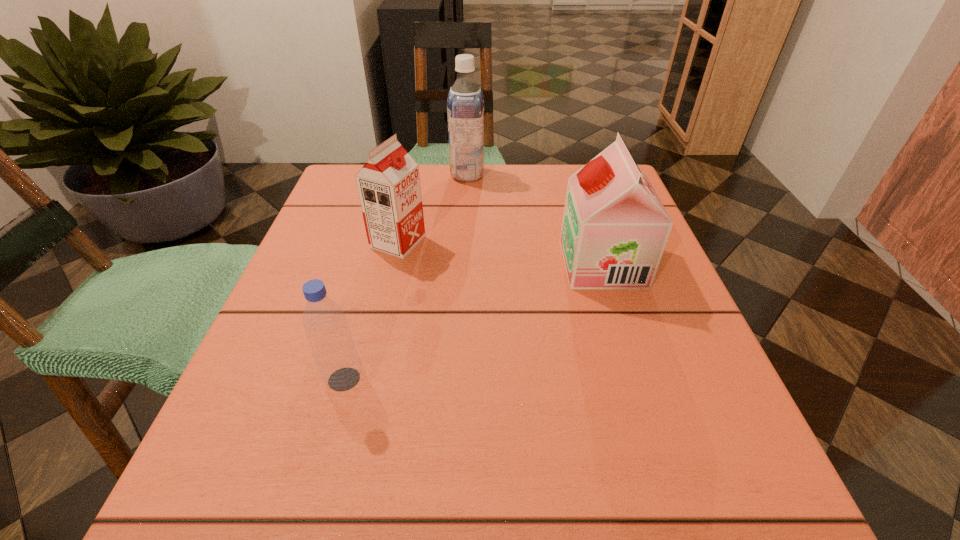
Find the location of a particular element. free spot between the farthest soya milk and the leftmost soya milk is located at coordinates (433, 208).

Identify which object is the third closest to the nearest object. Please provide its 2D coordinates. Your answer should be formatted as a tuple, i.e. [(x, y)], where the tuple contains the x and y coordinates of a point satisfying the conditions above.

[(465, 103)]

In order to click on the third closest object to the bottle in this screenshot , I will do [x=465, y=103].

You are a GUI agent. You are given a task and a screenshot of the screen. Output one action in this format:
    pyautogui.click(x=<x>, y=<y>)
    Task: Click on the soya milk that can be found as the second closest to the farthest soya milk
    The height and width of the screenshot is (540, 960).
    Given the screenshot: What is the action you would take?
    pyautogui.click(x=615, y=228)

At what (x,y) coordinates should I click in order to perform the action: click on soya milk that can be found as the closest to the tallest soya milk. Please return your answer as a coordinate pair (x, y). Looking at the image, I should click on (388, 185).

The image size is (960, 540). I want to click on free space that satisfies the following two spatial constraints: 1. on the label of the farthest soya milk; 2. on the front side of the leftmost soya milk, so click(x=465, y=242).